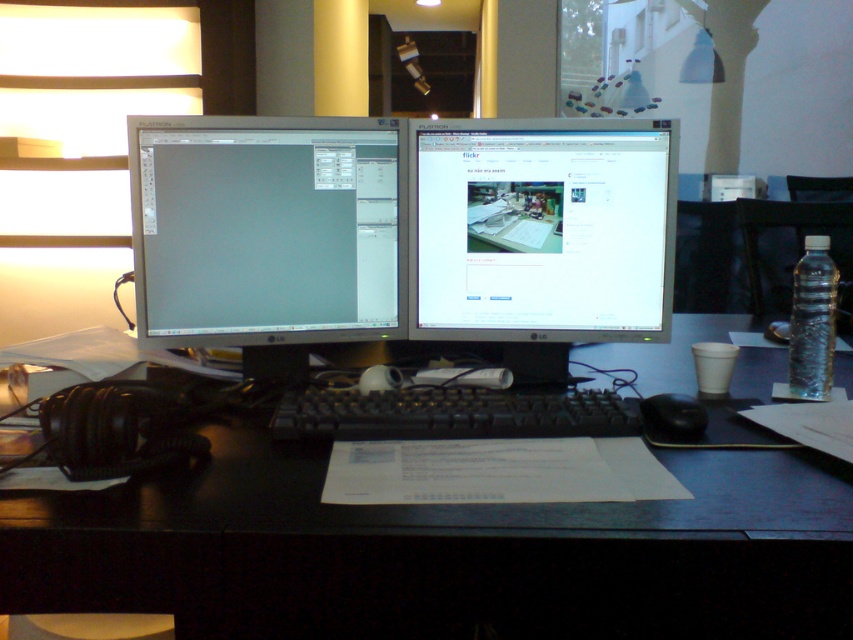
The height and width of the screenshot is (640, 853). Find the location of `black plastic computer desk at center`. black plastic computer desk at center is located at coordinates (439, 552).

Does black plastic computer desk at center have a greater height compared to matte black monitor at left?

Incorrect, black plastic computer desk at center's height is not larger of matte black monitor at left's.

Is point (781, 460) in front of point (166, 294)?

Yes, point (781, 460) is closer to viewer.

Locate an element on the screen. Image resolution: width=853 pixels, height=640 pixels. black plastic computer desk at center is located at coordinates (439, 552).

Measure the distance from white glossy monitor at center to black plastic keyboard at center.

The distance of white glossy monitor at center from black plastic keyboard at center is 10.34 inches.

From the picture: Does white glossy monitor at center lie in front of black plastic keyboard at center?

No, white glossy monitor at center is behind black plastic keyboard at center.

Does point (554, 289) lie in front of point (495, 419)?

No.

The image size is (853, 640). I want to click on white glossy monitor at center, so click(541, 228).

Image resolution: width=853 pixels, height=640 pixels. What do you see at coordinates (267, 228) in the screenshot?
I see `matte black monitor at left` at bounding box center [267, 228].

This screenshot has width=853, height=640. What do you see at coordinates (267, 228) in the screenshot?
I see `matte black monitor at left` at bounding box center [267, 228].

Identify the location of matte black monitor at left. (267, 228).